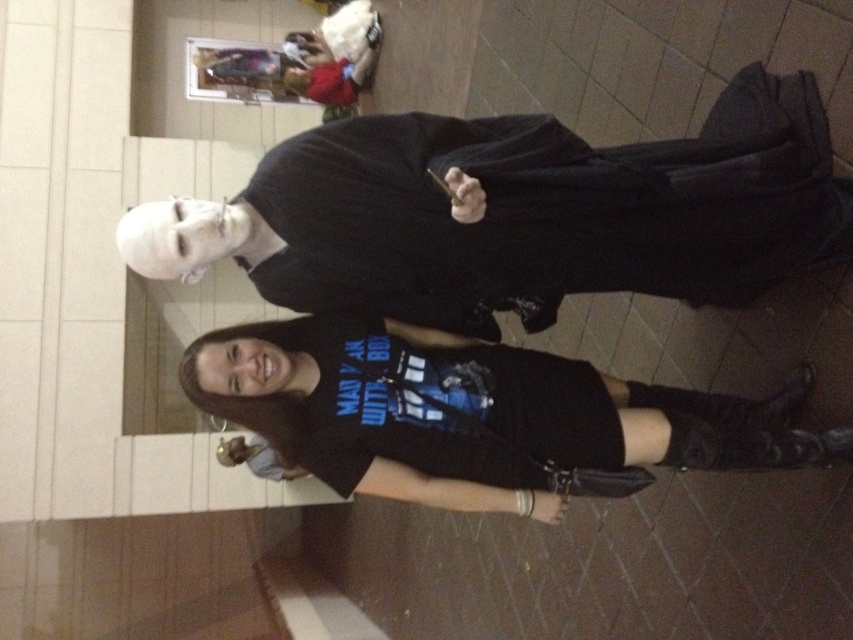
Can you confirm if black matte robe at upper center is positioned above black matte t-shirt at center?

Indeed, black matte robe at upper center is positioned over black matte t-shirt at center.

Who is more distant from viewer, (506,268) or (339,444)?

The point (339,444) is more distant.

Between point (737, 278) and point (292, 337), which one is positioned behind?

The point (737, 278) is behind.

Image resolution: width=853 pixels, height=640 pixels. In order to click on black matte robe at upper center in this screenshot , I will do `click(529, 212)`.